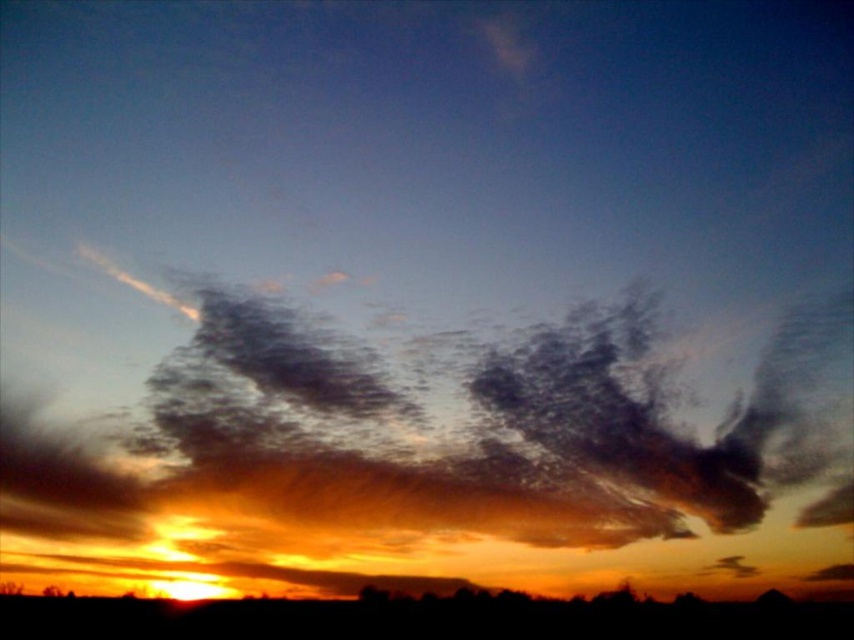
Is point (846, 451) farther from camera compared to point (180, 625)?

No, (846, 451) is in front of (180, 625).

Can you confirm if translucent orange cloud at center is wider than golden-orange sky at center?

No.

Find the location of a particular element. The image size is (854, 640). translucent orange cloud at center is located at coordinates (437, 460).